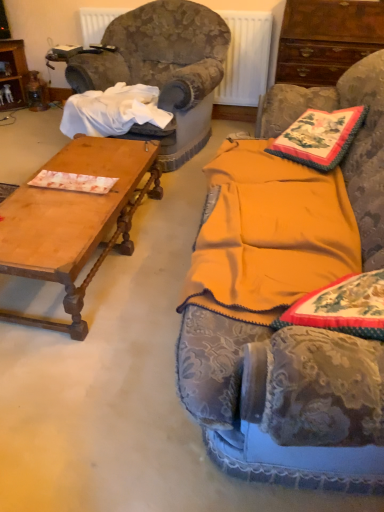
Identify the location of metallic radiator at upper center. (245, 58).

Find the location of a particular element. mahogany wood cabinet at upper right is located at coordinates (326, 39).

Considering the sizes of objects wooden polished coffee table at left and metallic radiator at upper center in the image provided, who is bigger, wooden polished coffee table at left or metallic radiator at upper center?

wooden polished coffee table at left is bigger.

Considering the sizes of wooden polished coffee table at left and metallic radiator at upper center in the image, is wooden polished coffee table at left taller or shorter than metallic radiator at upper center?

wooden polished coffee table at left is shorter than metallic radiator at upper center.

Does point (71, 337) lie behind point (113, 10)?

No, it is in front of (113, 10).

Is there a large distance between wooden polished coffee table at left and metallic radiator at upper center?

wooden polished coffee table at left is far away from metallic radiator at upper center.

Considering the sizes of velvet fabric couch at center and metallic radiator at upper center in the image, is velvet fabric couch at center wider or thinner than metallic radiator at upper center?

velvet fabric couch at center is wider than metallic radiator at upper center.

Which is nearer, (371,181) or (95,38)?

The point (371,181) is closer to the camera.

Is velvet fabric couch at center shorter than metallic radiator at upper center?

Incorrect, the height of velvet fabric couch at center does not fall short of that of metallic radiator at upper center.

Considering the sizes of objects embroidered fabric pillow at upper right and wooden polished coffee table at left in the image provided, who is smaller, embroidered fabric pillow at upper right or wooden polished coffee table at left?

embroidered fabric pillow at upper right is smaller.

Is embroidered fabric pillow at upper right spatially inside wooden polished coffee table at left, or outside of it?

embroidered fabric pillow at upper right lies outside wooden polished coffee table at left.

Which is less distant, (341, 112) or (126, 184)?

The point (126, 184) is closer to the camera.

Is embroidered fabric pillow at upper right behind wooden polished coffee table at left?

Yes, the depth of embroidered fabric pillow at upper right is greater than that of wooden polished coffee table at left.

Is metallic radiator at upper center to the left or to the right of wooden polished coffee table at left in the image?

In the image, metallic radiator at upper center appears on the right side of wooden polished coffee table at left.

Considering the positions of points (265, 84) and (7, 254), is point (265, 84) closer to camera compared to point (7, 254)?

No, (265, 84) is further to viewer.

Could you tell me if metallic radiator at upper center is facing wooden polished coffee table at left?

Yes, metallic radiator at upper center is oriented towards wooden polished coffee table at left.

Considering the relative positions of velvet-like fabric armchair at left and velvet fabric couch at center in the image provided, is velvet-like fabric armchair at left in front of velvet fabric couch at center?

No.

From a real-world perspective, is velvet-like fabric armchair at left above or below velvet fabric couch at center?

In terms of real-world spatial position, velvet-like fabric armchair at left is below velvet fabric couch at center.

Consider the image. Is velvet-like fabric armchair at left inside the boundaries of velvet fabric couch at center, or outside?

velvet-like fabric armchair at left lies outside velvet fabric couch at center.

Identify the location of studio couch in front of the velvet-like fabric armchair at left. (284, 380).

From a real-world perspective, is embroidered fabric pillow at upper right physically located above or below velvet-like fabric armchair at left?

Clearly, from a real-world perspective, embroidered fabric pillow at upper right is above velvet-like fabric armchair at left.

Consider the image. Is embroidered fabric pillow at upper right to the left or to the right of velvet-like fabric armchair at left in the image?

In the image, embroidered fabric pillow at upper right appears on the right side of velvet-like fabric armchair at left.

Is embroidered fabric pillow at upper right wider or thinner than velvet-like fabric armchair at left?

Clearly, embroidered fabric pillow at upper right has less width compared to velvet-like fabric armchair at left.

Where is `studio couch in front of the velvet-like fabric armchair at left`? This screenshot has height=512, width=384. studio couch in front of the velvet-like fabric armchair at left is located at coordinates (284, 380).

Who is taller, velvet fabric couch at center or velvet-like fabric armchair at left?

velvet fabric couch at center.

Is velvet fabric couch at center in front of or behind velvet-like fabric armchair at left in the image?

Visually, velvet fabric couch at center is located in front of velvet-like fabric armchair at left.

From a real-world perspective, is velvet fabric couch at center located beneath velvet-like fabric armchair at left?

No, from a real-world perspective, velvet fabric couch at center is not beneath velvet-like fabric armchair at left.

Locate an element on the screen. The image size is (384, 512). coffee table below the metallic radiator at upper center (from the image's perspective) is located at coordinates (74, 221).

I want to click on studio couch above the metallic radiator at upper center (from a real-world perspective), so click(284, 380).

From the image, which object appears to be nearer to velvet fabric couch at center, mahogany wood cabinet at upper right or embroidered fabric pillow at upper right?

embroidered fabric pillow at upper right.

From the image, which object appears to be nearer to mahogany wood cabinet at upper right, velvet-like fabric armchair at left or wooden polished coffee table at left?

velvet-like fabric armchair at left lies closer to mahogany wood cabinet at upper right than the other object.

Considering their positions, is velvet fabric couch at center positioned further to metallic radiator at upper center than embroidered fabric pillow at upper right?

embroidered fabric pillow at upper right is positioned further to the anchor metallic radiator at upper center.

Looking at the image, which one is located further to metallic radiator at upper center, velvet fabric couch at center or wooden polished coffee table at left?

wooden polished coffee table at left lies further to metallic radiator at upper center than the other object.

Which object lies further to the anchor point metallic radiator at upper center, mahogany wood cabinet at upper right or velvet-like fabric armchair at left?

The object further to metallic radiator at upper center is velvet-like fabric armchair at left.

Estimate the real-world distances between objects in this image. Which object is further from mahogany wood cabinet at upper right, velvet-like fabric armchair at left or embroidered fabric pillow at upper right?

The object further to mahogany wood cabinet at upper right is embroidered fabric pillow at upper right.

Which object lies nearer to the anchor point metallic radiator at upper center, embroidered fabric pillow at upper right or velvet fabric couch at center?

velvet fabric couch at center is closer to metallic radiator at upper center.

When comparing their distances from embroidered fabric pillow at upper right, does velvet fabric couch at center or velvet-like fabric armchair at left seem closer?

velvet fabric couch at center lies closer to embroidered fabric pillow at upper right than the other object.

Locate an element on the screen. The height and width of the screenshot is (512, 384). pillow between wooden polished coffee table at left and mahogany wood cabinet at upper right in the horizontal direction is located at coordinates (319, 137).

What are the coordinates of `chair between wooden polished coffee table at left and embroidered fabric pillow at upper right in the horizontal direction` in the screenshot? It's located at (163, 69).

Find the location of a particular element. Image resolution: width=384 pixels, height=512 pixels. chair between velvet fabric couch at center and mahogany wood cabinet at upper right along the z-axis is located at coordinates (163, 69).

Identify the location of pillow between wooden polished coffee table at left and metallic radiator at upper center in the front-back direction. (319, 137).